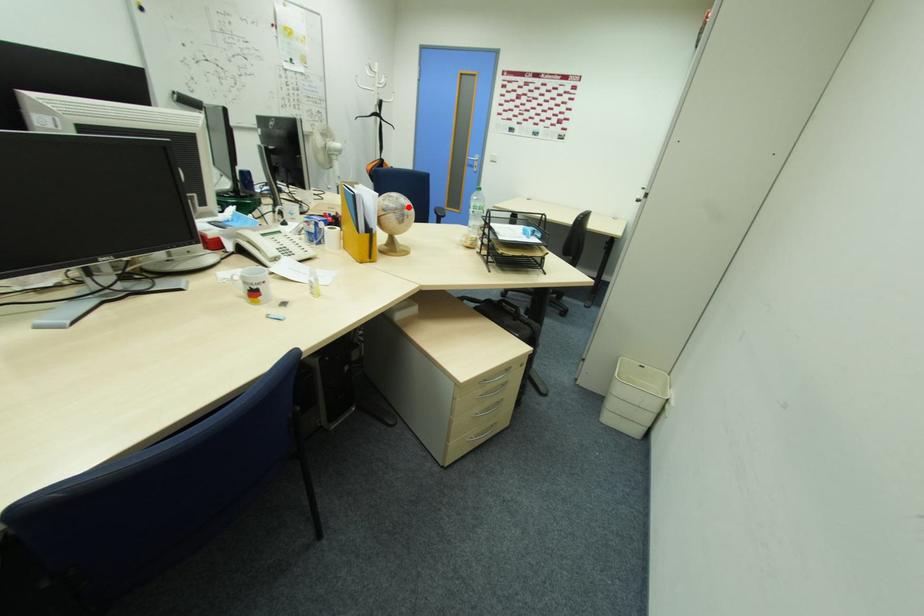
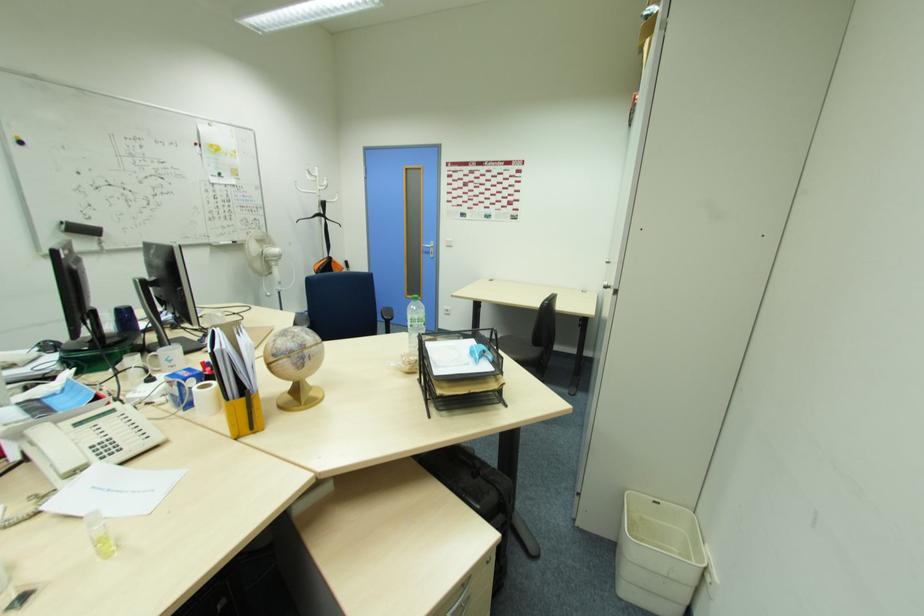
The point at the highlighted location is marked in the first image. Where is the corresponding point in the second image?

(309, 346)